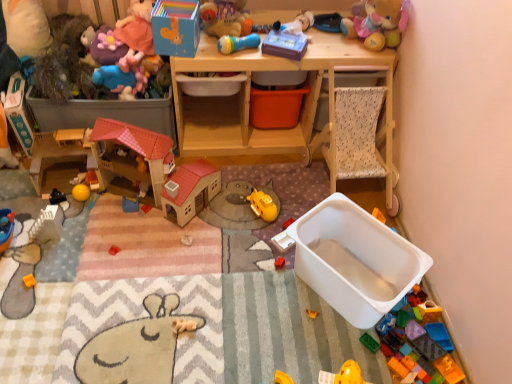
Locate an element on the screen. This screenshot has height=384, width=512. free location to the right of yellow rubber ball at center-left, the second toy positioned from the left is located at coordinates (112, 202).